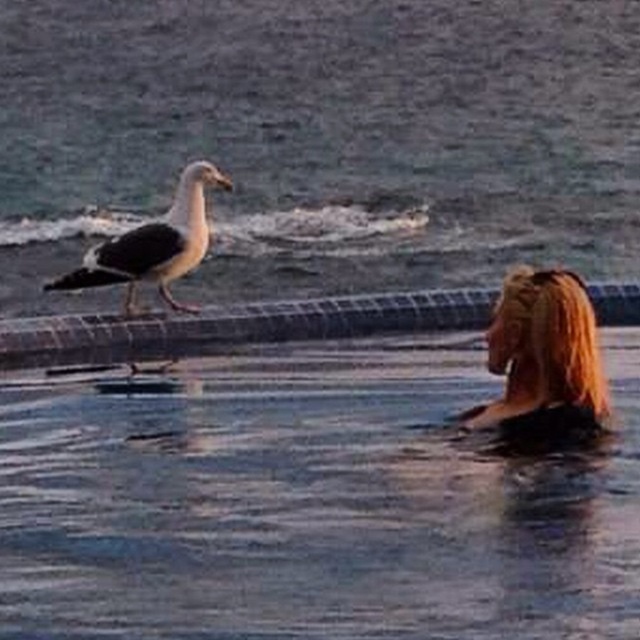
Does blonde hair at upper right have a lesser width compared to black-feathered seagull at left?

Indeed, blonde hair at upper right has a lesser width compared to black-feathered seagull at left.

Does blonde hair at upper right appear over black-feathered seagull at left?

No.

Who is more forward, (560, 356) or (193, 212)?

Point (560, 356)

Locate an element on the screen. This screenshot has height=640, width=640. blonde hair at upper right is located at coordinates (544, 358).